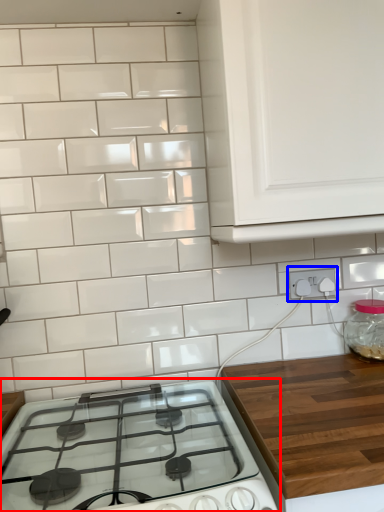
Question: Which object appears farthest to the camera in this image, gas stove (highlighted by a red box) or electric outlet (highlighted by a blue box)?

Choices:
 (A) gas stove
 (B) electric outlet

Answer: (B)